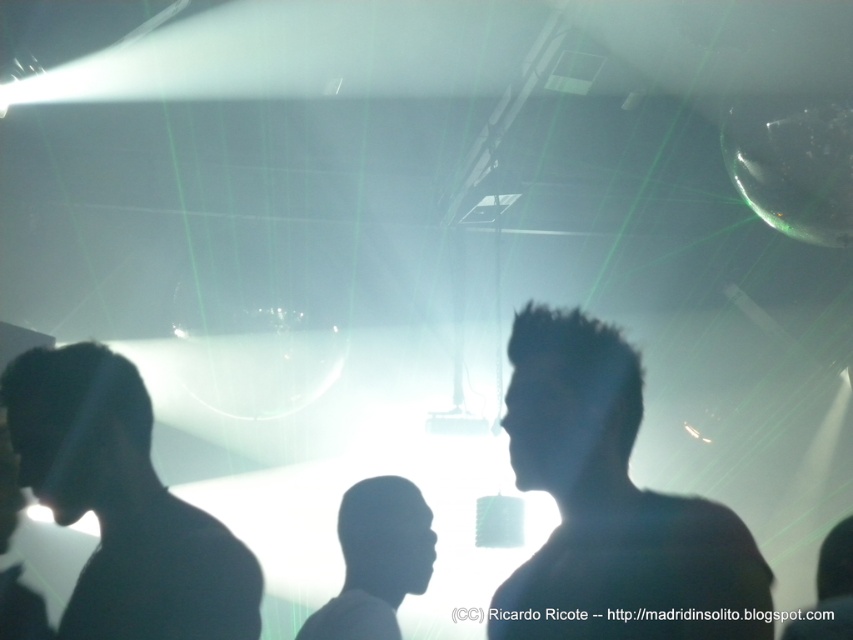
Question: Can you confirm if silhouette hair at center is bigger than black matte head at left?

Choices:
 (A) yes
 (B) no

Answer: (A)

Question: Among these points, which one is farthest from the camera?

Choices:
 (A) (47, 392)
 (B) (521, 435)
 (C) (389, 637)

Answer: (C)

Question: Does silhouette hair at center appear over black matte head at left?

Choices:
 (A) no
 (B) yes

Answer: (B)

Question: Which point is farther from the camera taking this photo?

Choices:
 (A) (354, 550)
 (B) (41, 406)

Answer: (A)

Question: Which object is positioned closest to the dark matte head at center?

Choices:
 (A) silhouette hair at center
 (B) black matte head at left

Answer: (B)

Question: Where is silhouette hair at center located in relation to black matte head at left in the image?

Choices:
 (A) below
 (B) above

Answer: (B)